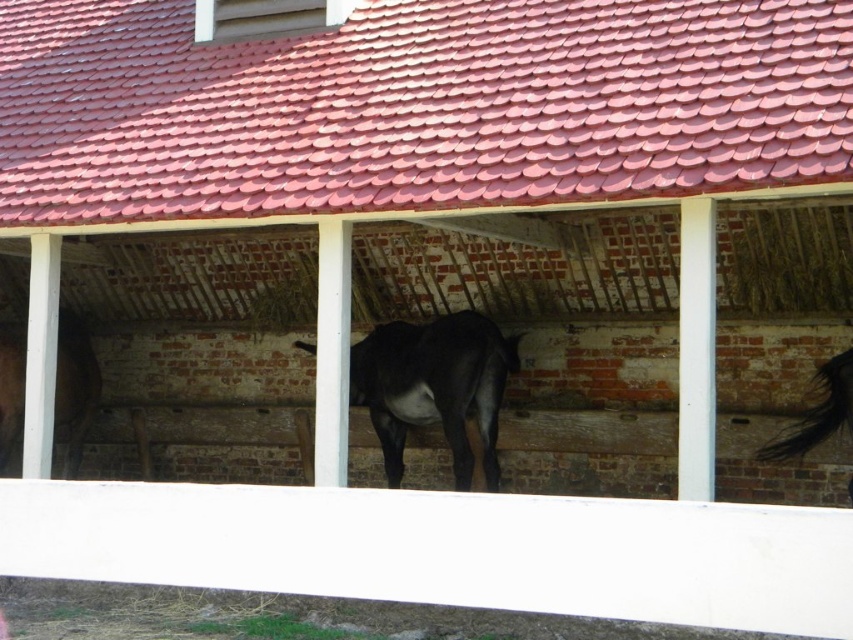
You are a farmer who wants to place a new hay bale in the stable. The hay bale must be placed at point 0.605, 0.510. Is the black glossy horse at center currently occupying that location?

The position of black glossy horse at center is at point (434, 387), so yes, the horse is occupying that location.

You are a farmer entering the stable and need to check both the black glossy horse at center and the black glossy horse at right. Which horse should you check first if you want to check the one that is located above the other?

You should check the black glossy horse at right first because it is positioned above the black glossy horse at center according to the description.

Based on the photo, you are standing at the entrance of the stable and want to approach the black glossy horse at center. Based on its position, in which general direction should you walk to reach it?

The black glossy horse at center is located at point 0.605 on the x axis and 0.510 on the y axis. Since you are at the entrance, which is typically at the front of the stable, you should walk forward towards the center of the stable to reach the black glossy horse at center.